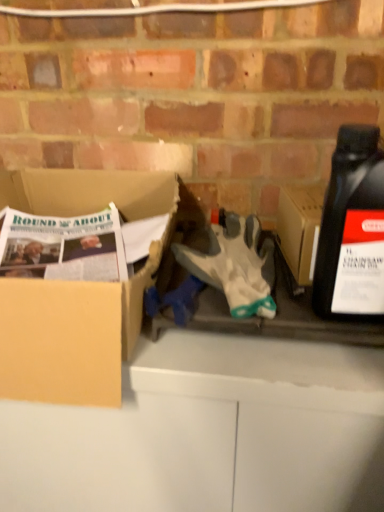
Question: Is the depth of black plastic bottle at right greater than that of white fabric glove at center?

Choices:
 (A) no
 (B) yes

Answer: (A)

Question: Can white fabric glove at center be found inside black plastic bottle at right?

Choices:
 (A) no
 (B) yes

Answer: (A)

Question: Considering the relative sizes of black plastic bottle at right and white fabric glove at center in the image provided, is black plastic bottle at right bigger than white fabric glove at center?

Choices:
 (A) yes
 (B) no

Answer: (A)

Question: Is black plastic bottle at right to the left of white fabric glove at center from the viewer's perspective?

Choices:
 (A) yes
 (B) no

Answer: (B)

Question: Could you tell me if black plastic bottle at right is facing white fabric glove at center?

Choices:
 (A) yes
 (B) no

Answer: (B)

Question: In terms of height, does black plastic bottle at right look taller or shorter compared to white fabric glove at center?

Choices:
 (A) short
 (B) tall

Answer: (B)

Question: Does point (357, 259) appear closer or farther from the camera than point (269, 300)?

Choices:
 (A) farther
 (B) closer

Answer: (B)

Question: From the image's perspective, relative to white fabric glove at center, is black plastic bottle at right above or below?

Choices:
 (A) below
 (B) above

Answer: (B)

Question: Is black plastic bottle at right situated inside white fabric glove at center or outside?

Choices:
 (A) inside
 (B) outside

Answer: (B)

Question: Is black plastic bottle at right inside the boundaries of cardboard box at left, or outside?

Choices:
 (A) inside
 (B) outside

Answer: (B)

Question: In the image, is black plastic bottle at right on the left side or the right side of cardboard box at left?

Choices:
 (A) right
 (B) left

Answer: (A)

Question: Considering the positions of black plastic bottle at right and cardboard box at left in the image, is black plastic bottle at right bigger or smaller than cardboard box at left?

Choices:
 (A) small
 (B) big

Answer: (A)

Question: Is black plastic bottle at right in front of or behind cardboard box at left in the image?

Choices:
 (A) front
 (B) behind

Answer: (A)

Question: From the image's perspective, relative to cardboard box at left, is white fabric glove at center above or below?

Choices:
 (A) below
 (B) above

Answer: (A)

Question: Does point (244, 298) appear closer or farther from the camera than point (21, 286)?

Choices:
 (A) farther
 (B) closer

Answer: (A)